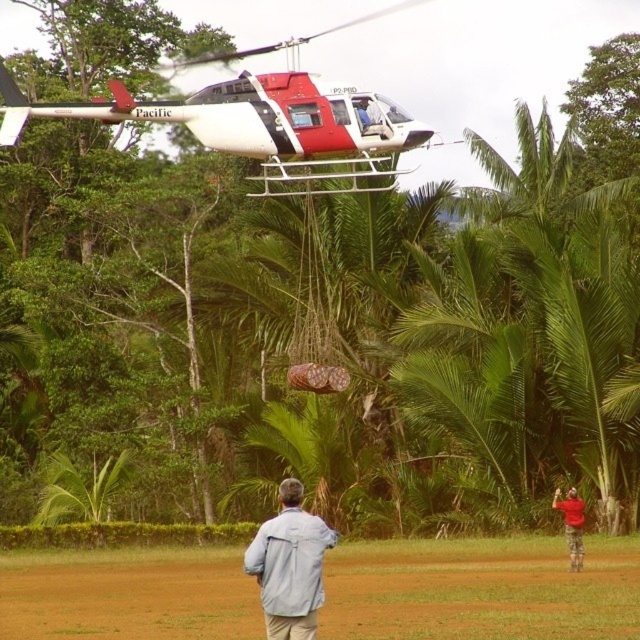
You are a safety officer on the ground and need to ensure that the red cotton shirt at lower right is at least 100 feet away from the red and white helicopter at upper center for safety. Based on the scene, is the current distance compliant with the safety requirement?

The distance between the red and white helicopter at upper center and the red cotton shirt at lower right is 105.04 feet, which exceeds the minimum required 100 feet, so the current distance is compliant with the safety requirement.

You are a safety officer at the scene. You need to ensure that the red cotton shirt at lower right can see the red and white helicopter at upper center without obstruction. Is there anything blocking their view?

The red and white helicopter at upper center is in front of the red cotton shirt at lower right, so the helicopter is blocking the view of the shirt. However, the question is about the shirt seeing the helicopter. Since the helicopter is in front of the shirt, the shirt would have an unobstructed view of the helicopter unless there are other objects in between, but according to the provided information, there are no other objects mentioned. Therefore, the red cotton shirt at lower right can see the red and

You are a photographer trying to capture the entire scene of the brown dirt field at lower center and the red and white helicopter at upper center in one shot. Based on their sizes in the image, which object should you focus on to ensure both are visible without cropping?

The brown dirt field at lower center occupies less space than the red and white helicopter at upper center. To capture both in one shot, focus on the larger object, the red and white helicopter at upper center, as it will dominate the frame while still allowing the smaller brown dirt field at lower center to be visible.